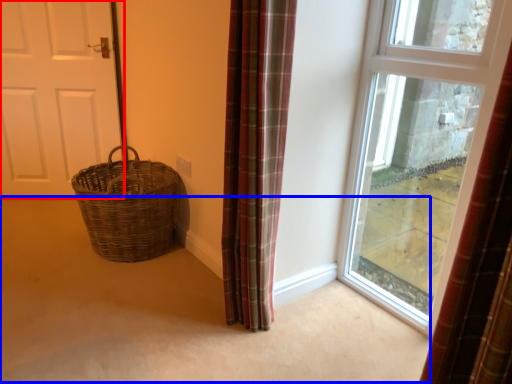
Question: Among these objects, which one is nearest to the camera, door (highlighted by a red box) or corridor (highlighted by a blue box)?

Choices:
 (A) door
 (B) corridor

Answer: (B)